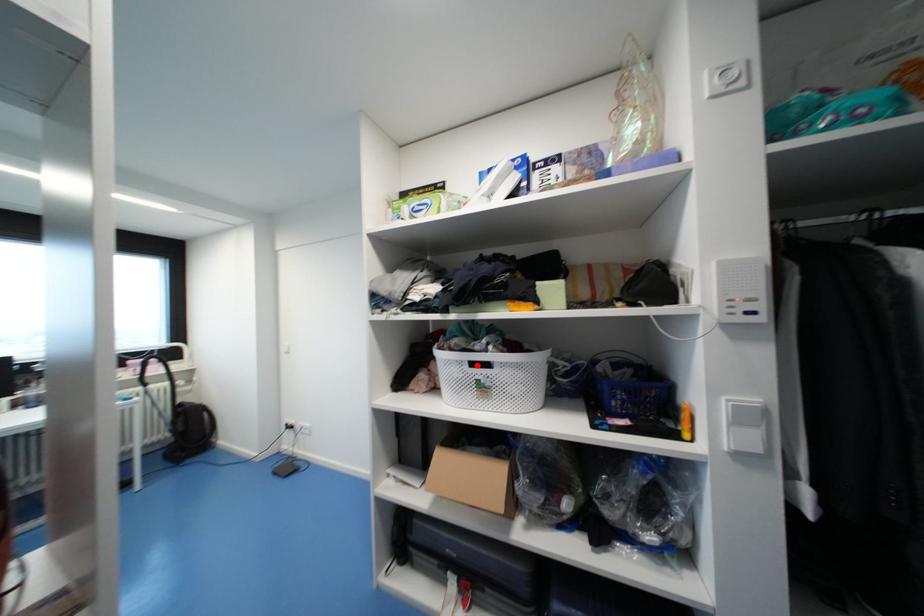
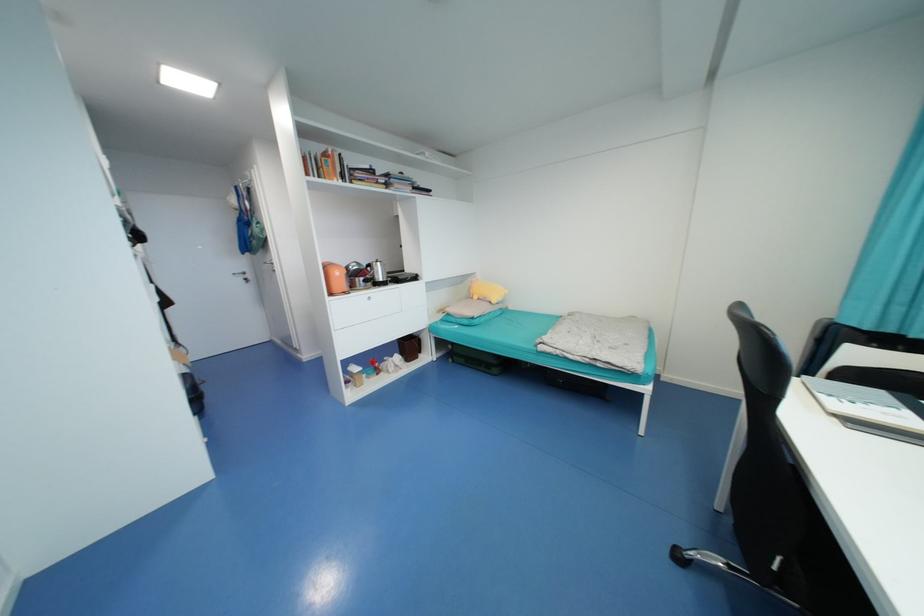
Question: I am providing you with two images of the same scene from different viewpoints. A red point is marked on the first image. Can you still see the location of the red point in image 2?

Choices:
 (A) Yes
 (B) No

Answer: (B)